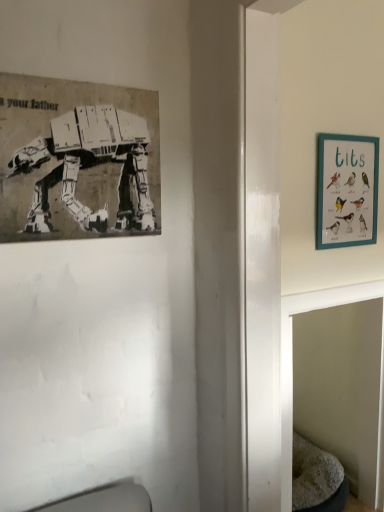
Question: Relative to gray fabric cat bed at lower right, is teal wooden picture frame at upper right, acting as the 2th picture frame starting from the front, in front or behind?

Choices:
 (A) behind
 (B) front

Answer: (A)

Question: In the image, is teal wooden picture frame at upper right, arranged as the first picture frame when viewed from the back, on the left side or the right side of gray fabric cat bed at lower right?

Choices:
 (A) right
 (B) left

Answer: (B)

Question: Considering the real-world distances, which object is farthest from the gray fabric cat bed at lower right?

Choices:
 (A) teal wooden picture frame at upper right, which is the 2th picture frame from left to right
 (B) black paper poster at upper left, acting as the 1th picture frame starting from the left

Answer: (B)

Question: Considering the real-world distances, which object is farthest from the teal wooden picture frame at upper right, acting as the 2th picture frame starting from the front?

Choices:
 (A) black paper poster at upper left, acting as the 1th picture frame starting from the left
 (B) gray fabric cat bed at lower right

Answer: (A)